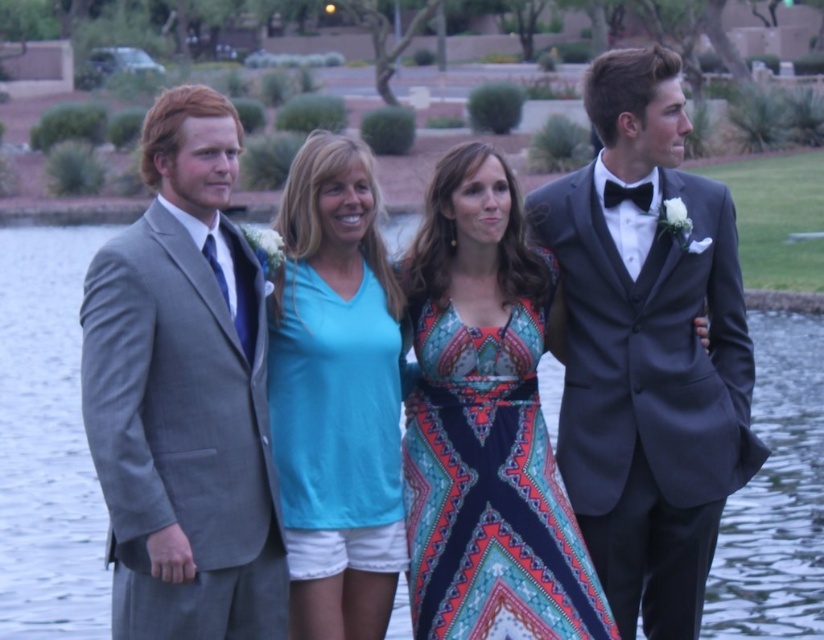
Question: Which point appears farthest from the camera in this image?

Choices:
 (A) (255, 548)
 (B) (663, 410)
 (C) (518, 486)
 (D) (400, 497)

Answer: (B)

Question: Estimate the real-world distances between objects in this image. Which object is farther from the gray wool suit at left?

Choices:
 (A) teal fabric shirt at center
 (B) shiny black suit at right

Answer: (B)

Question: Does teal fabric shirt at center have a smaller size compared to printed fabric dress at center?

Choices:
 (A) yes
 (B) no

Answer: (A)

Question: Is shiny black suit at right in front of printed fabric dress at center?

Choices:
 (A) yes
 (B) no

Answer: (B)

Question: Does shiny black suit at right appear under gray wool suit at left?

Choices:
 (A) no
 (B) yes

Answer: (A)

Question: Which point is closer to the camera taking this photo?

Choices:
 (A) (691, 531)
 (B) (485, 340)
 (C) (209, 408)
 (D) (345, 310)

Answer: (C)